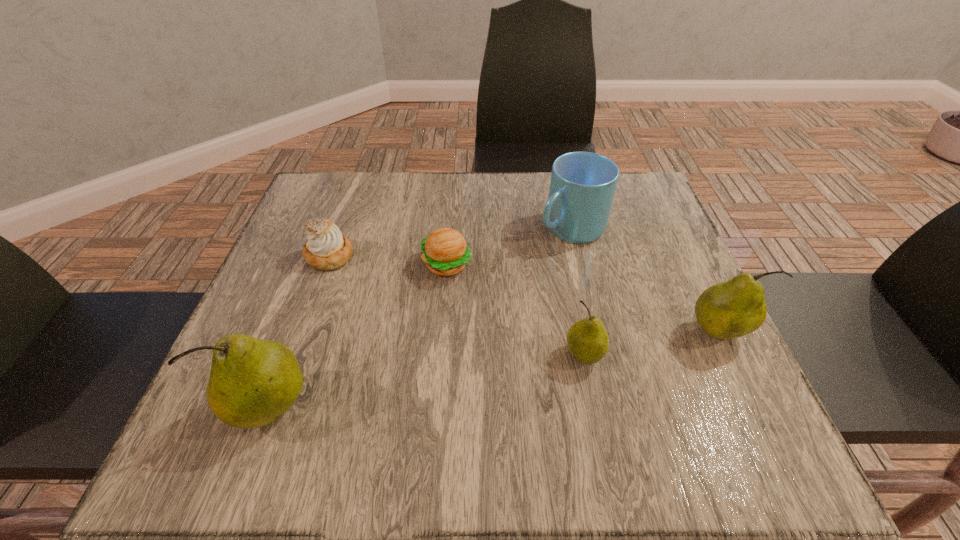
Image resolution: width=960 pixels, height=540 pixels. In order to click on vacant position in the image that satisfies the following two spatial constraints: 1. on the back side of the second pear from right to left; 2. on the right side of the mug in this screenshot , I will do `click(559, 228)`.

Where is `vacant area that satisfies the following two spatial constraints: 1. on the back side of the second pear from left to right; 2. on the left side of the leftmost pear`? The width and height of the screenshot is (960, 540). vacant area that satisfies the following two spatial constraints: 1. on the back side of the second pear from left to right; 2. on the left side of the leftmost pear is located at coordinates (291, 355).

Image resolution: width=960 pixels, height=540 pixels. What are the coordinates of `vacant region that satisfies the following two spatial constraints: 1. on the front side of the second tallest pear; 2. on the left side of the mug` in the screenshot? It's located at (595, 333).

You are a GUI agent. You are given a task and a screenshot of the screen. Output one action in this format:
    pyautogui.click(x=<x>, y=<y>)
    Task: Click on the vacant region that satisfies the following two spatial constraints: 1. on the front side of the third object from left to right; 2. on the left side of the pastry
    The image size is (960, 540).
    Given the screenshot: What is the action you would take?
    pyautogui.click(x=326, y=265)